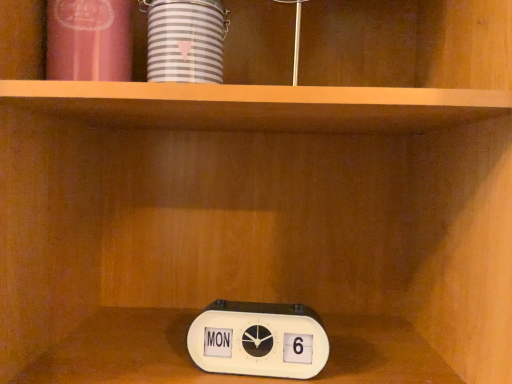
Locate an element on the screen. Image resolution: width=512 pixels, height=384 pixels. white plastic clock at lower center is located at coordinates (259, 340).

What do you see at coordinates (259, 340) in the screenshot? I see `white plastic clock at lower center` at bounding box center [259, 340].

What is the approximate width of white plastic clock at lower center?

The width of white plastic clock at lower center is 1.76 inches.

Find the location of a particular element. The image size is (512, 384). white plastic clock at lower center is located at coordinates (259, 340).